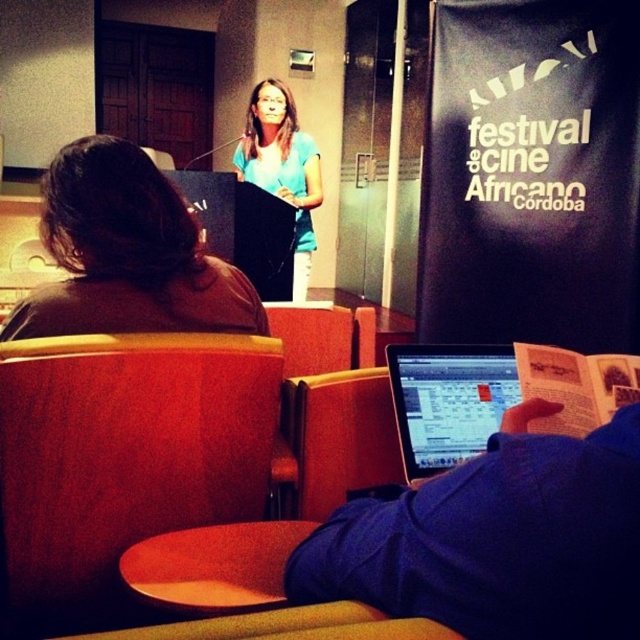
Is point (401, 428) behind point (300, 141)?

No, it is in front of (300, 141).

I want to click on silver metallic laptop at center, so click(x=449, y=401).

Locate an element on the screen. Image resolution: width=640 pixels, height=640 pixels. silver metallic laptop at center is located at coordinates (449, 401).

Image resolution: width=640 pixels, height=640 pixels. What do you see at coordinates (125, 253) in the screenshot?
I see `brown hair at upper left` at bounding box center [125, 253].

Can you confirm if brown hair at upper left is wider than silver metallic laptop at center?

Indeed, brown hair at upper left has a greater width compared to silver metallic laptop at center.

Find the location of a particular element. The width and height of the screenshot is (640, 640). brown hair at upper left is located at coordinates (125, 253).

Locate an element on the screen. This screenshot has width=640, height=640. brown hair at upper left is located at coordinates (125, 253).

Which is below, matte red chair at left or silver metallic laptop at center?

Positioned lower is matte red chair at left.

Where is `matte red chair at left`? The width and height of the screenshot is (640, 640). matte red chair at left is located at coordinates (124, 456).